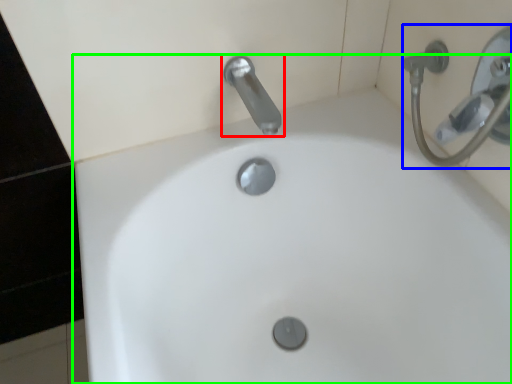
Question: Based on their relative distances, which object is farther from tap (highlighted by a red box)? Choose from shower (highlighted by a blue box) and sink (highlighted by a green box).

Choices:
 (A) shower
 (B) sink

Answer: (B)